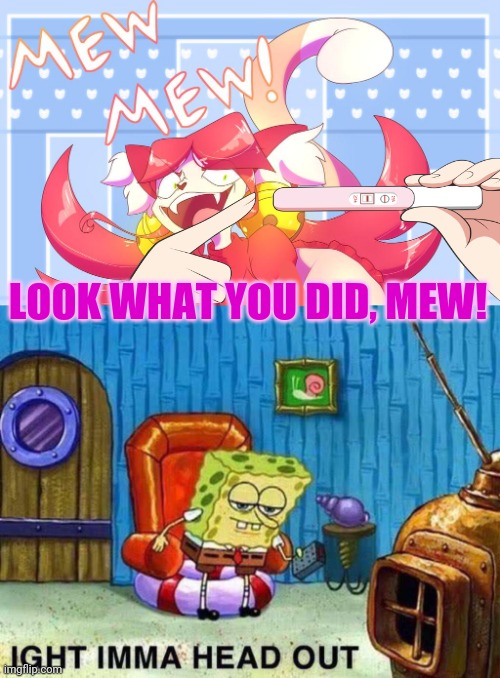
Identify the location of wall. The height and width of the screenshot is (678, 500). (208, 384).